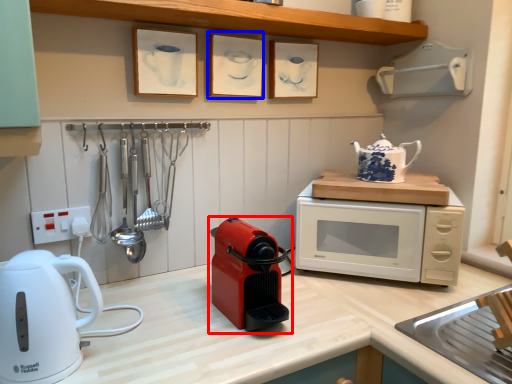
Question: Among these objects, which one is farthest to the camera, home appliance (highlighted by a red box) or picture frame (highlighted by a blue box)?

Choices:
 (A) home appliance
 (B) picture frame

Answer: (B)